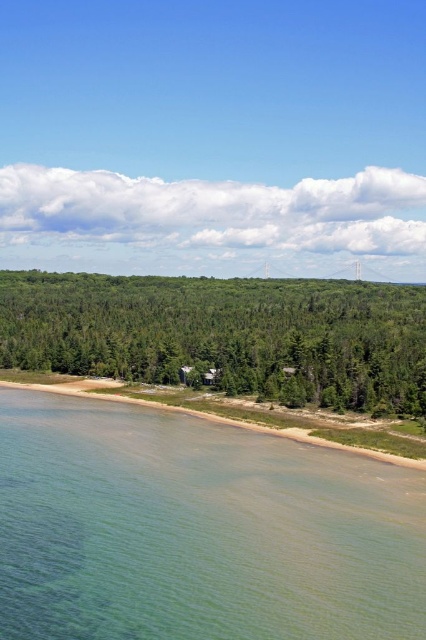
Question: In this image, where is clear water at lower left located relative to green leafy trees at center?

Choices:
 (A) below
 (B) above

Answer: (A)

Question: Among these points, which one is farthest from the camera?

Choices:
 (A) (175, 621)
 (B) (69, 289)

Answer: (B)

Question: Which object is closer to the camera taking this photo?

Choices:
 (A) clear water at lower left
 (B) green leafy trees at center

Answer: (A)

Question: Does clear water at lower left have a lesser width compared to green leafy trees at center?

Choices:
 (A) no
 (B) yes

Answer: (B)

Question: Is clear water at lower left closer to camera compared to green leafy trees at center?

Choices:
 (A) no
 (B) yes

Answer: (B)